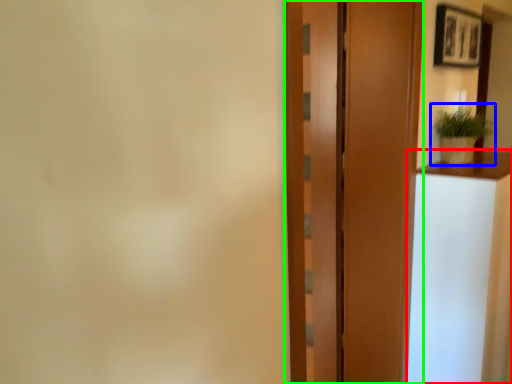
Question: Considering the real-world distances, which object is farthest from vanity (highlighted by a red box)? houseplant (highlighted by a blue box) or door (highlighted by a green box)?

Choices:
 (A) houseplant
 (B) door

Answer: (A)